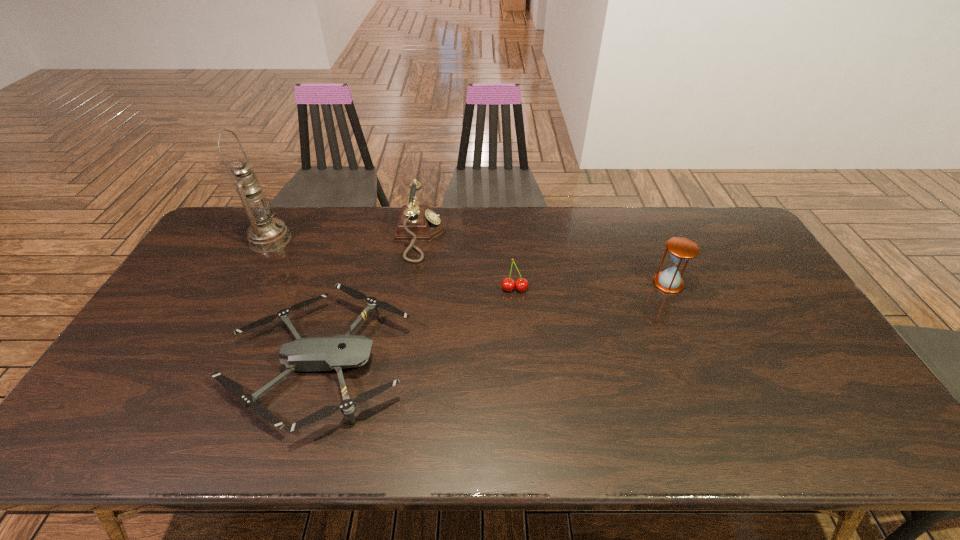
This screenshot has height=540, width=960. I want to click on oil lamp, so click(x=265, y=234).

Locate an element on the screen. This screenshot has width=960, height=540. telephone is located at coordinates (417, 223).

Locate an element on the screen. the rightmost object is located at coordinates (681, 249).

Locate an element on the screen. This screenshot has width=960, height=540. cherry is located at coordinates (508, 284).

In order to click on the second object from right to left in this screenshot , I will do `click(508, 284)`.

Locate an element on the screen. drone is located at coordinates (338, 352).

The height and width of the screenshot is (540, 960). I want to click on the shortest object, so click(338, 352).

What are the coordinates of `vacant position located on the front of the oil lamp` in the screenshot? It's located at (226, 322).

Image resolution: width=960 pixels, height=540 pixels. What are the coordinates of `vacant space situated on the dial of the telephone` in the screenshot? It's located at (464, 237).

Find the location of a particular element. free location located on the front of the rightmost object is located at coordinates (695, 345).